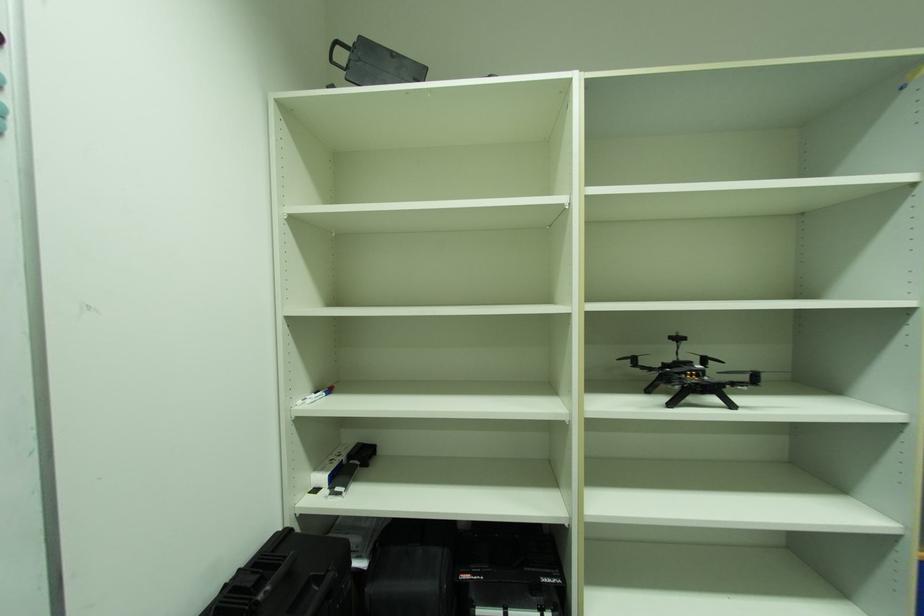
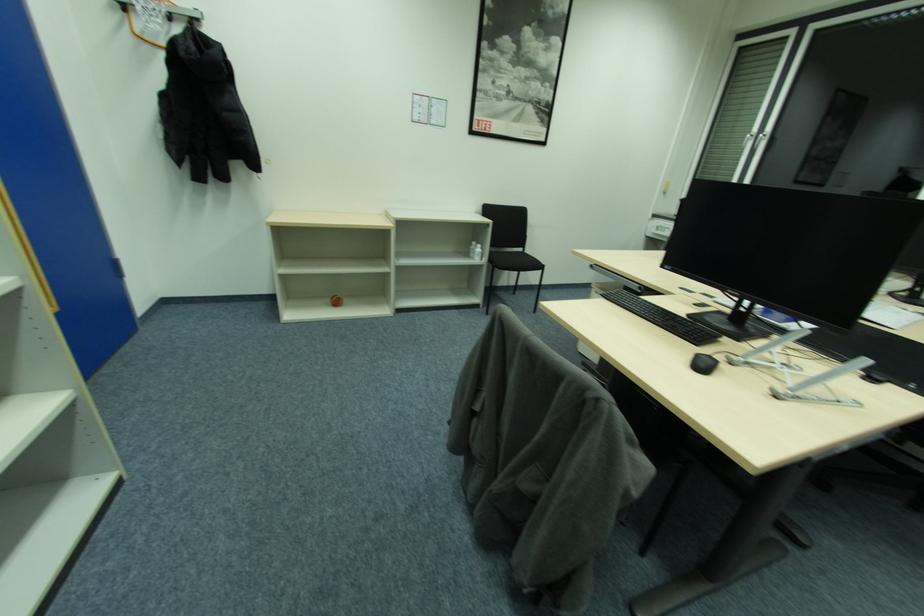
The first image is from the beginning of the video and the second image is from the end. How did the camera likely rotate when shooting the video?

The camera's rotation is toward right-down.